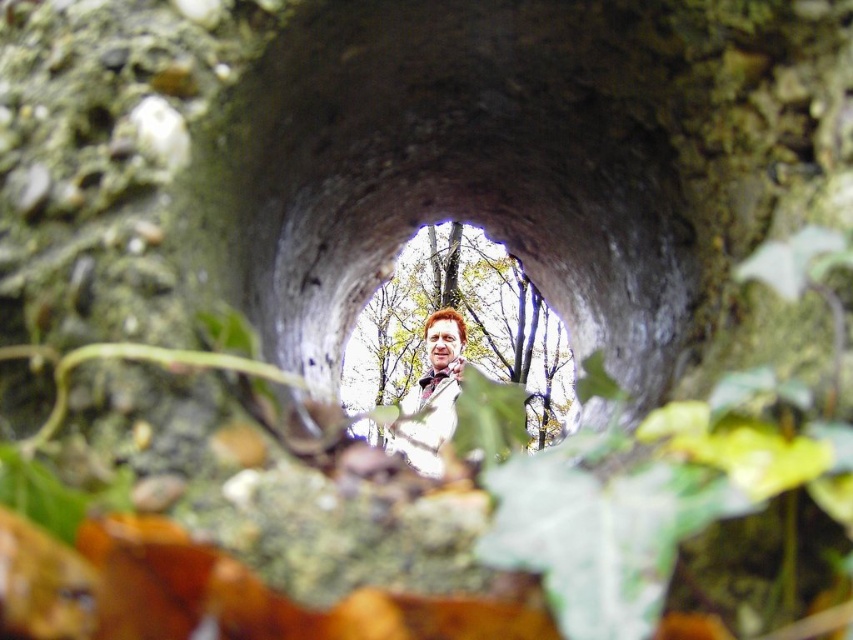
Question: Which point is farther to the camera?

Choices:
 (A) (436, 339)
 (B) (461, 314)

Answer: (B)

Question: Is smooth concrete hole at center bigger than light brown leather jacket at center?

Choices:
 (A) no
 (B) yes

Answer: (A)

Question: Does smooth concrete hole at center come in front of light brown leather jacket at center?

Choices:
 (A) yes
 (B) no

Answer: (B)

Question: Which object appears closest to the camera in this image?

Choices:
 (A) light brown leather jacket at center
 (B) smooth concrete hole at center

Answer: (A)

Question: Is smooth concrete hole at center above light brown leather jacket at center?

Choices:
 (A) no
 (B) yes

Answer: (B)